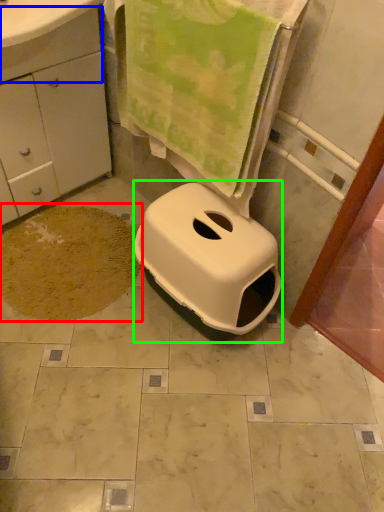
Question: Which is farther away from dirt (highlighted by a red box)? drawer (highlighted by a blue box) or bidet (highlighted by a green box)?

Choices:
 (A) drawer
 (B) bidet

Answer: (A)